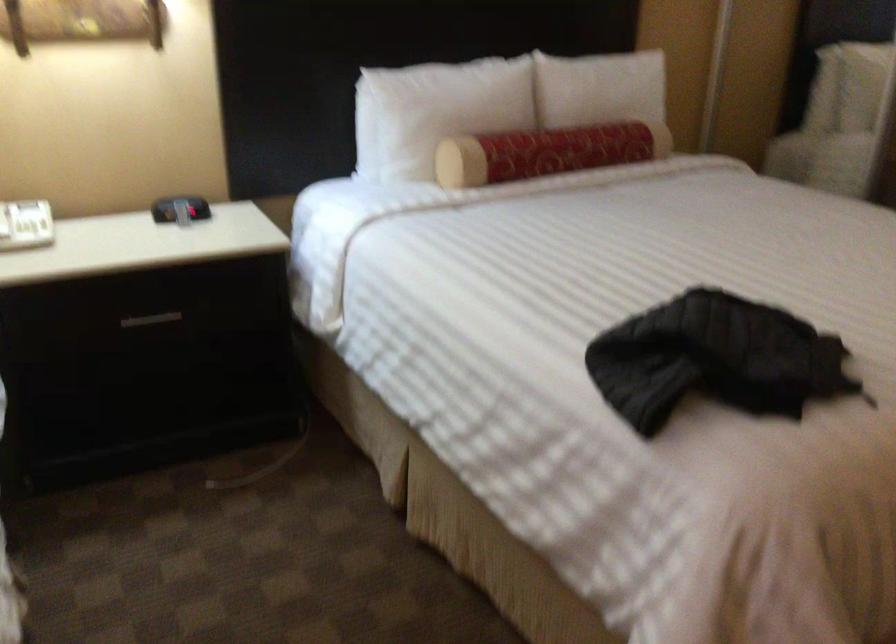
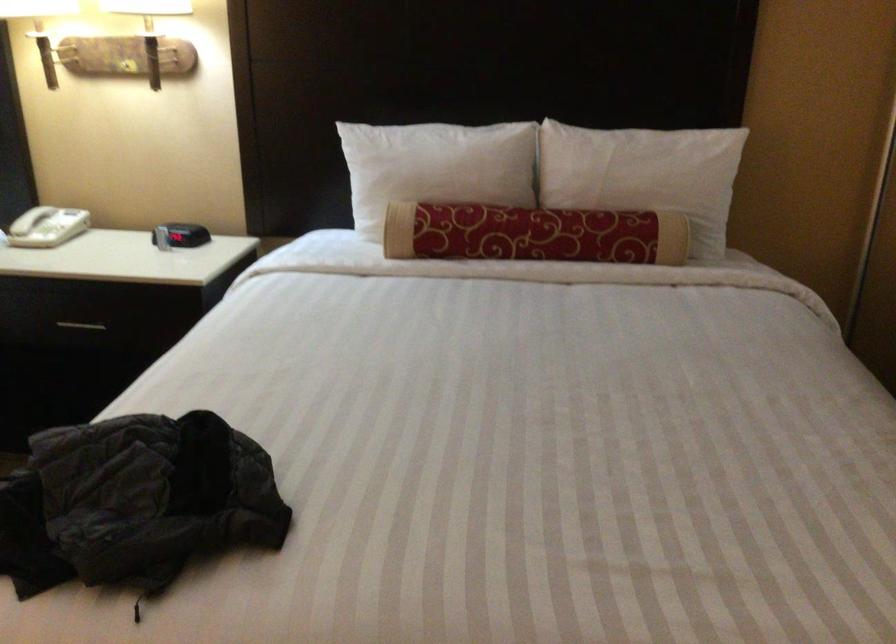
In the second image, find the point that corresponds to [477,100] in the first image.

(435, 167)